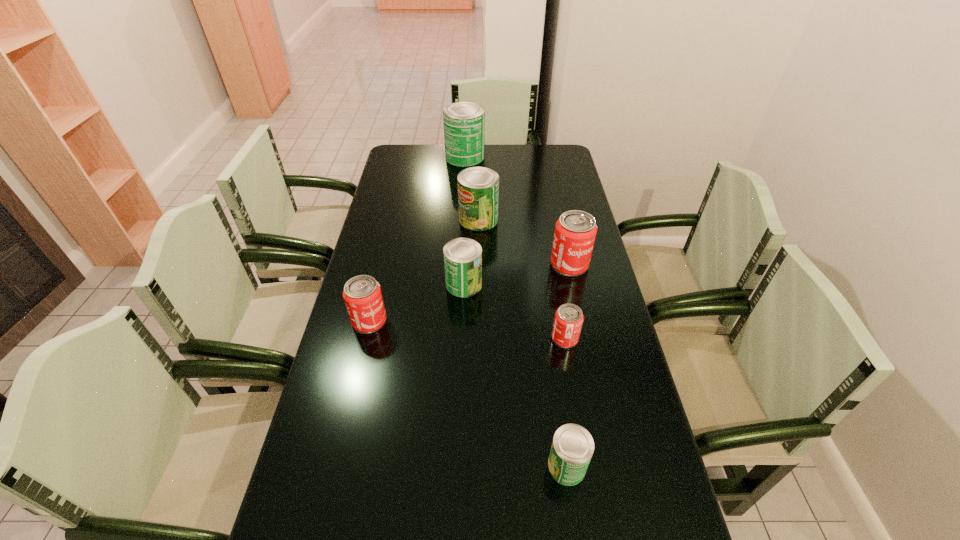
Where is `free space that satisfies the following two spatial constraints: 1. on the front side of the second biggest green can; 2. on the right side of the nearest object`? free space that satisfies the following two spatial constraints: 1. on the front side of the second biggest green can; 2. on the right side of the nearest object is located at coordinates (477, 465).